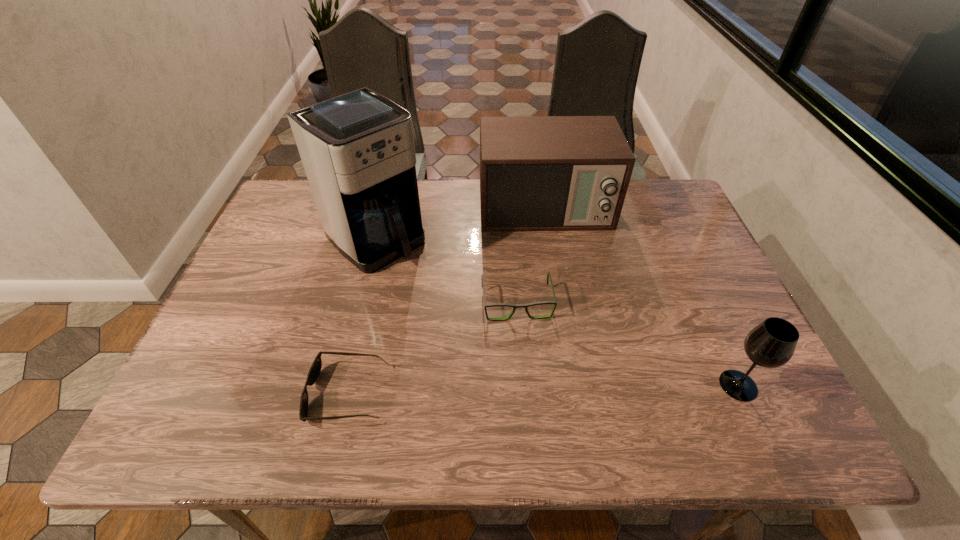
You are a GUI agent. You are given a task and a screenshot of the screen. Output one action in this format:
    pyautogui.click(x=<x>, y=<y>)
    Task: Click on the coffee maker that is at the far edge
    The width and height of the screenshot is (960, 540).
    Given the screenshot: What is the action you would take?
    pyautogui.click(x=357, y=149)

The image size is (960, 540). What are the coordinates of `radio receiver that is at the far edge` in the screenshot? It's located at (537, 173).

This screenshot has width=960, height=540. I want to click on sunglasses that is at the near edge, so click(x=316, y=366).

Where is `wineglass that is at the near edge`? Image resolution: width=960 pixels, height=540 pixels. wineglass that is at the near edge is located at coordinates (771, 344).

Locate an element on the screen. object positioned at the right edge is located at coordinates (771, 344).

Image resolution: width=960 pixels, height=540 pixels. In order to click on object that is at the near right corner in this screenshot , I will do `click(771, 344)`.

I want to click on vacant space at the far edge, so click(x=452, y=203).

Where is `vacant position at the near edge of the desktop`? vacant position at the near edge of the desktop is located at coordinates (452, 372).

Find the location of a particular element. vacant space at the left edge is located at coordinates (234, 344).

Locate an element on the screen. The width and height of the screenshot is (960, 540). vacant region at the right edge is located at coordinates (674, 281).